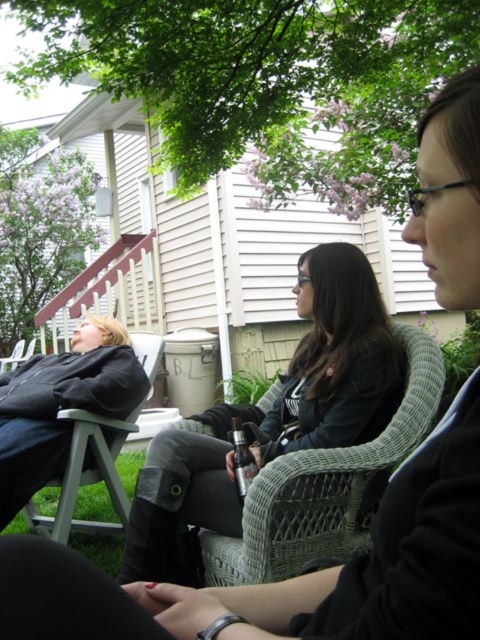
Which is below, woven wicker chair at center or wooden porch at upper left?

woven wicker chair at center is lower down.

Is woven wicker chair at center shorter than wooden porch at upper left?

Correct, woven wicker chair at center is not as tall as wooden porch at upper left.

Which is behind, point (259, 572) or point (148, 253)?

The point (148, 253) is behind.

This screenshot has height=640, width=480. Find the location of `woven wicker chair at center`. woven wicker chair at center is located at coordinates (324, 488).

Is woven wicker chair at center smaller than matte black chair at left?

Correct, woven wicker chair at center occupies less space than matte black chair at left.

How distant is woven wicker chair at center from matte black chair at left?

woven wicker chair at center and matte black chair at left are 30.92 inches apart from each other.

Between point (275, 392) and point (37, 520), which one is positioned in front?

Point (275, 392) is in front.

Locate an element on the screen. Image resolution: width=480 pixels, height=640 pixels. woven wicker chair at center is located at coordinates pyautogui.click(x=324, y=488).

Can you confirm if wooden porch at upper left is taller than matte black chair at left?

Yes.

Does point (120, 278) come in front of point (158, 355)?

No, (120, 278) is behind (158, 355).

Who is more distant from viewer, (145, 273) or (43, 520)?

Point (145, 273)

The image size is (480, 640). What are the coordinates of `wooden porch at upper left` in the screenshot? It's located at (108, 291).